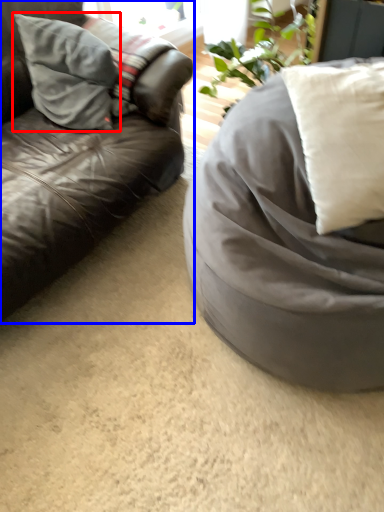
Question: Which object appears farthest to the camera in this image, pillow (highlighted by a red box) or studio couch (highlighted by a blue box)?

Choices:
 (A) pillow
 (B) studio couch

Answer: (A)